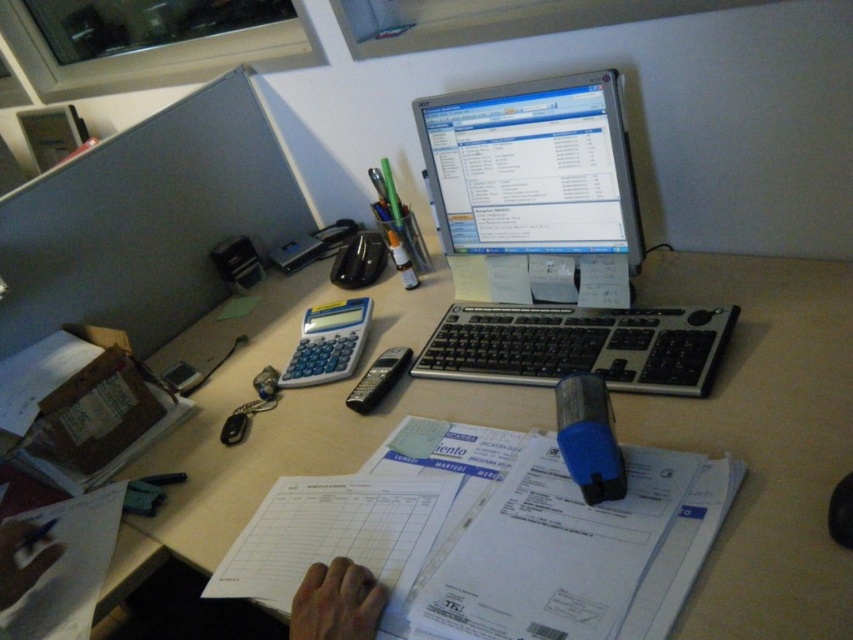
Question: Observing the image, what is the correct spatial positioning of silver/black keyboard at center in reference to skinny flesh at lower center?

Choices:
 (A) right
 (B) left

Answer: (A)

Question: Among these points, which one is farthest from the camera?

Choices:
 (A) (308, 577)
 (B) (514, 332)

Answer: (B)

Question: Among these points, which one is nearest to the camera?

Choices:
 (A) [x=10, y=529]
 (B) [x=450, y=337]

Answer: (A)

Question: Which point is farther to the camera?

Choices:
 (A) (537, 214)
 (B) (614, 320)
 (C) (712, 390)

Answer: (A)

Question: Is silver/black keyboard at center above matte black hand at lower center?

Choices:
 (A) no
 (B) yes

Answer: (B)

Question: Can you confirm if white plastic computer desk at center is positioned below skinny flesh at lower center?

Choices:
 (A) yes
 (B) no

Answer: (B)